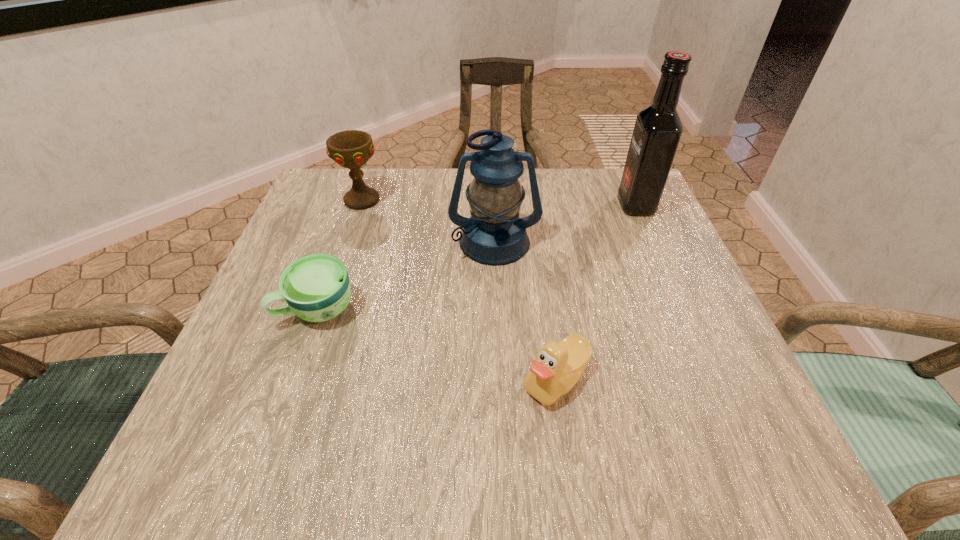
Locate which object ranks second in proximity to the cup. Please provide its 2D coordinates. Your answer should be formatted as a tuple, i.e. [(x, y)], where the tuple contains the x and y coordinates of a point satisfying the conditions above.

[(351, 149)]